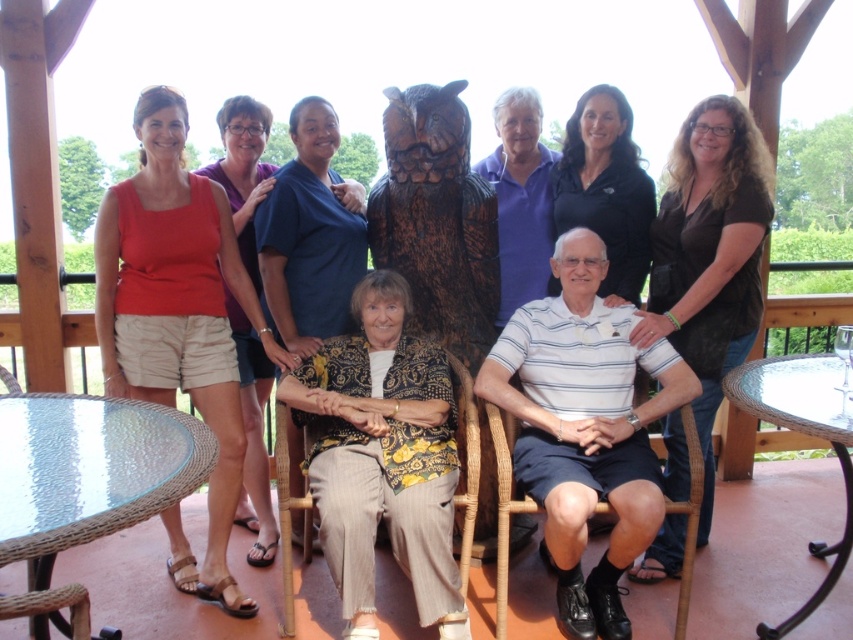
You are a photographer trying to capture a photo of the clear glass table at lower right without including the matte orange tank top at left in the frame. Based on their positions, is this possible?

The clear glass table at lower right is behind the matte orange tank top at left, so it would be difficult to capture the clear glass table at lower right without including the matte orange tank top at left in the frame since the table is positioned behind the tank top.

You are a photographer setting up for a group photo. You notice the matte orange tank top at left and the clear glass table at lower right. Which object should you focus on first if you want to capture the taller object in your shot?

The matte orange tank top at left is taller than the clear glass table at lower right, so you should focus on the matte orange tank top at left first.